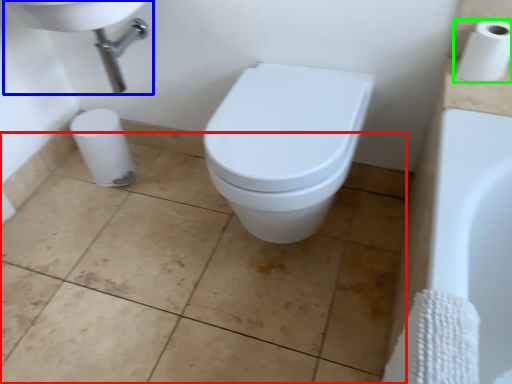
Question: Considering the real-world distances, which object is closest to ceramic tile (highlighted by a red box)? sink (highlighted by a blue box) or toilet paper (highlighted by a green box).

Choices:
 (A) sink
 (B) toilet paper

Answer: (A)